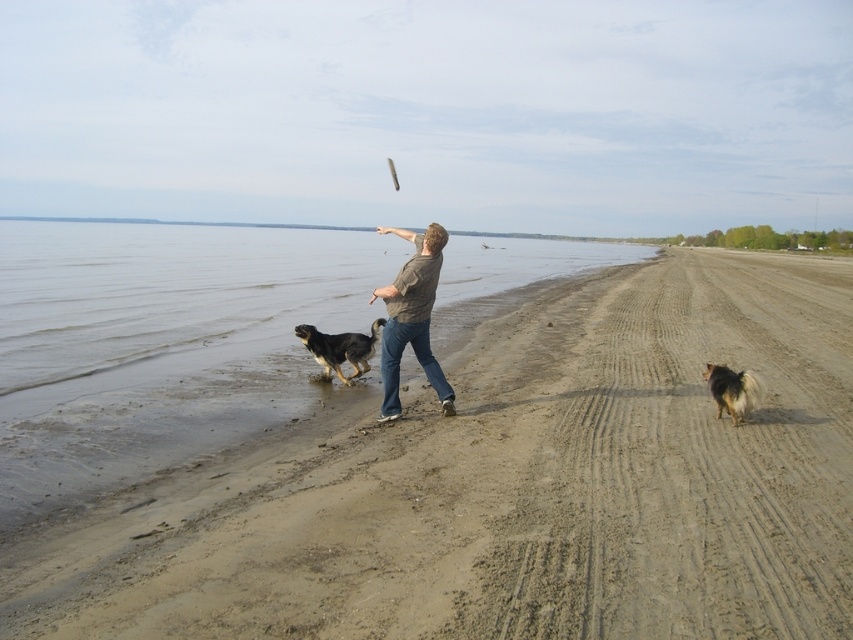
Who is lower down, gray cotton shirt at center or black and white fur dog at center?

black and white fur dog at center

Is gray cotton shirt at center further to the viewer compared to black and white fur dog at center?

No, gray cotton shirt at center is closer to the viewer.

Between point (405, 237) and point (351, 348), which one is positioned in front?

Point (405, 237)

Where is `gray cotton shirt at center`? gray cotton shirt at center is located at coordinates (410, 317).

Does gray cotton shirt at center appear under fluffy brown dog at right?

Actually, gray cotton shirt at center is above fluffy brown dog at right.

Is point (393, 355) more distant than point (747, 372)?

Yes.

Is point (392, 417) less distant than point (756, 397)?

No, it is not.

At what (x,y) coordinates should I click in order to perform the action: click on gray cotton shirt at center. Please return your answer as a coordinate pair (x, y). The height and width of the screenshot is (640, 853). Looking at the image, I should click on (410, 317).

Does brown sand at lower left have a larger size compared to white plastic frisbee at center?

Indeed, brown sand at lower left has a larger size compared to white plastic frisbee at center.

Between brown sand at lower left and white plastic frisbee at center, which one is positioned higher?

white plastic frisbee at center is above.

In the scene shown: Who is more forward, (90, 344) or (393, 170)?

Point (90, 344) is in front.

The width and height of the screenshot is (853, 640). Find the location of `brown sand at lower left`. brown sand at lower left is located at coordinates (170, 291).